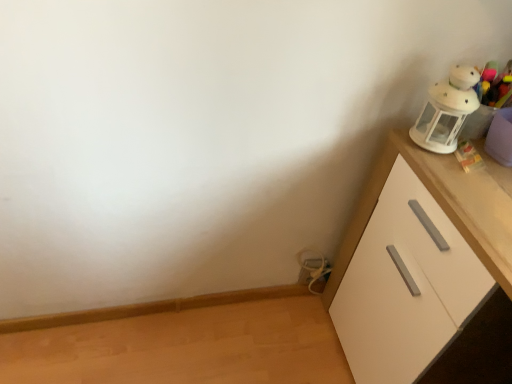
Question: Does white matte cabinet at right lie behind metallic silver cable at lower center, acting as the 1th toy starting from the left?

Choices:
 (A) no
 (B) yes

Answer: (A)

Question: From the image's perspective, does white matte cabinet at right appear lower than metallic silver cable at lower center, which ranks as the 2th toy in front-to-back order?

Choices:
 (A) yes
 (B) no

Answer: (A)

Question: Considering the relative sizes of white matte cabinet at right and metallic silver cable at lower center, marked as the 1th toy in a back-to-front arrangement, in the image provided, is white matte cabinet at right bigger than metallic silver cable at lower center, marked as the 1th toy in a back-to-front arrangement,?

Choices:
 (A) yes
 (B) no

Answer: (A)

Question: From a real-world perspective, is white matte cabinet at right beneath metallic silver cable at lower center, which ranks as the 2th toy in front-to-back order?

Choices:
 (A) yes
 (B) no

Answer: (B)

Question: Is white matte cabinet at right thinner than metallic silver cable at lower center, which is the second toy in right-to-left order?

Choices:
 (A) no
 (B) yes

Answer: (A)

Question: Is white matte cabinet at right closer to the viewer compared to metallic silver cable at lower center, which ranks as the first toy in bottom-to-top order?

Choices:
 (A) no
 (B) yes

Answer: (B)

Question: Is metallic silver cable at lower center, marked as the 1th toy in a back-to-front arrangement, taller than white matte cabinet at right?

Choices:
 (A) yes
 (B) no

Answer: (B)

Question: Is metallic silver cable at lower center, which ranks as the 2th toy in front-to-back order, aimed at white matte cabinet at right?

Choices:
 (A) no
 (B) yes

Answer: (A)

Question: From a real-world perspective, is metallic silver cable at lower center, acting as the 1th toy starting from the left, under white matte cabinet at right?

Choices:
 (A) yes
 (B) no

Answer: (A)

Question: Is metallic silver cable at lower center, marked as the 1th toy in a back-to-front arrangement, shorter than white matte cabinet at right?

Choices:
 (A) no
 (B) yes

Answer: (B)

Question: Would you say metallic silver cable at lower center, which ranks as the first toy in bottom-to-top order, contains white matte cabinet at right?

Choices:
 (A) yes
 (B) no

Answer: (B)

Question: From the image's perspective, is metallic silver cable at lower center, which ranks as the 2th toy in front-to-back order, below white matte cabinet at right?

Choices:
 (A) yes
 (B) no

Answer: (B)

Question: From the image's perspective, is white matte cabinet at right located beneath white plush toy at upper right, which is the second toy in bottom-to-top order?

Choices:
 (A) yes
 (B) no

Answer: (A)